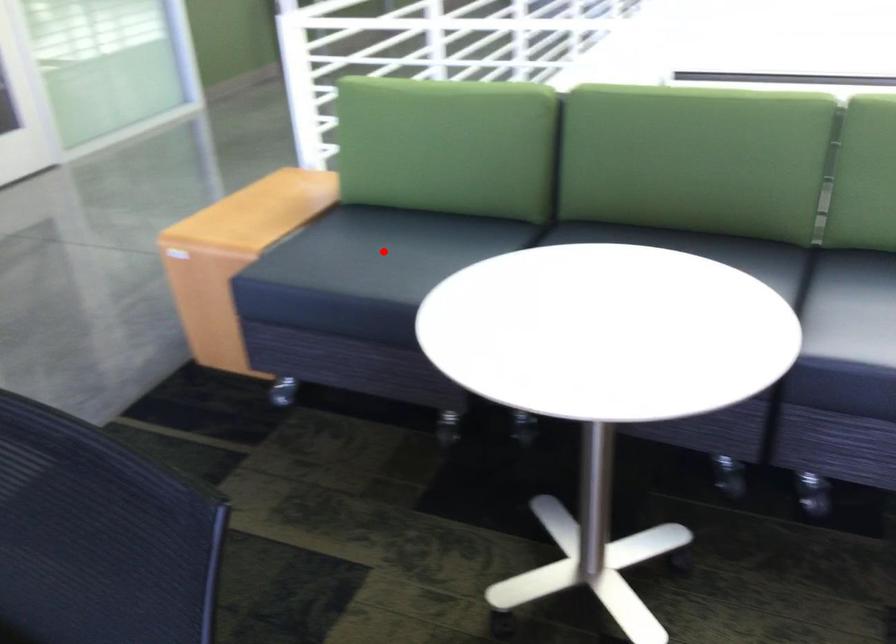
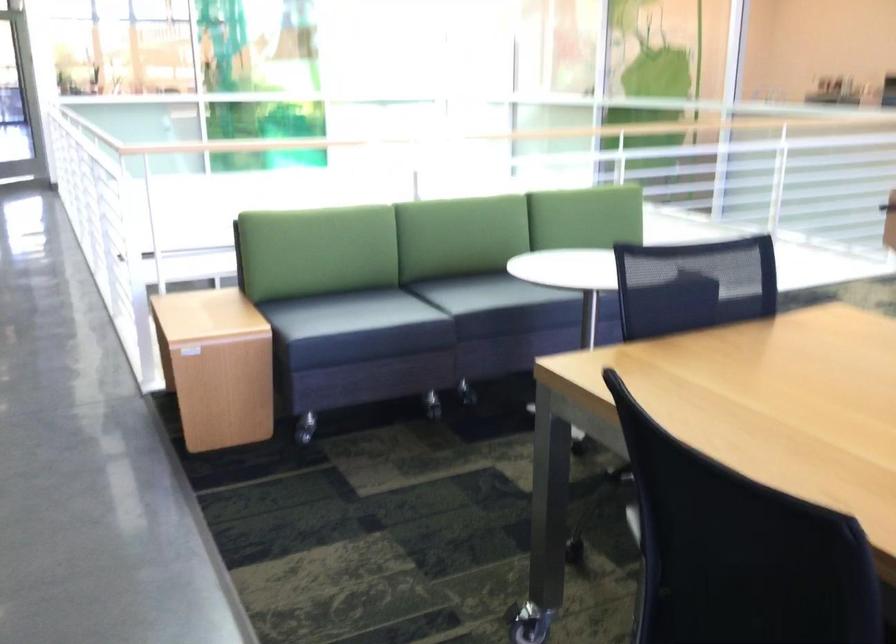
Question: A red point is marked in image1. In image2, is the corresponding 3D point closer to the camera or farther? Reply with the corresponding letter.

Choices:
 (A) The corresponding 3D point is closer.
 (B) The corresponding 3D point is farther.

Answer: (B)